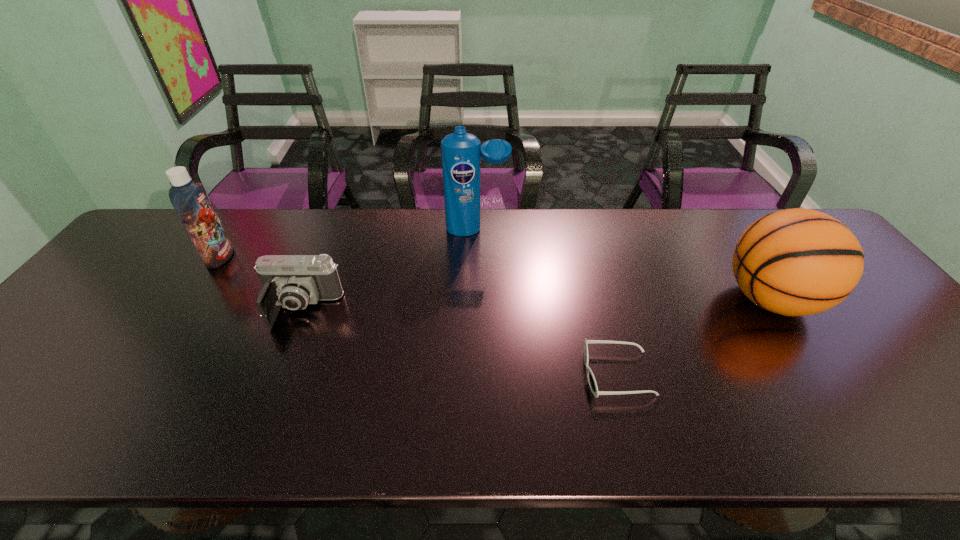
The height and width of the screenshot is (540, 960). In order to click on vacant space that is in between the second object from right to left and the leftmost object in this screenshot , I will do `click(419, 315)`.

Identify which object is the second nearest to the second object from left to right. Please provide its 2D coordinates. Your answer should be formatted as a tuple, i.e. [(x, y)], where the tuple contains the x and y coordinates of a point satisfying the conditions above.

[(460, 151)]

In order to click on object that is the fourth closest one to the second object from left to right in this screenshot , I will do `click(794, 262)`.